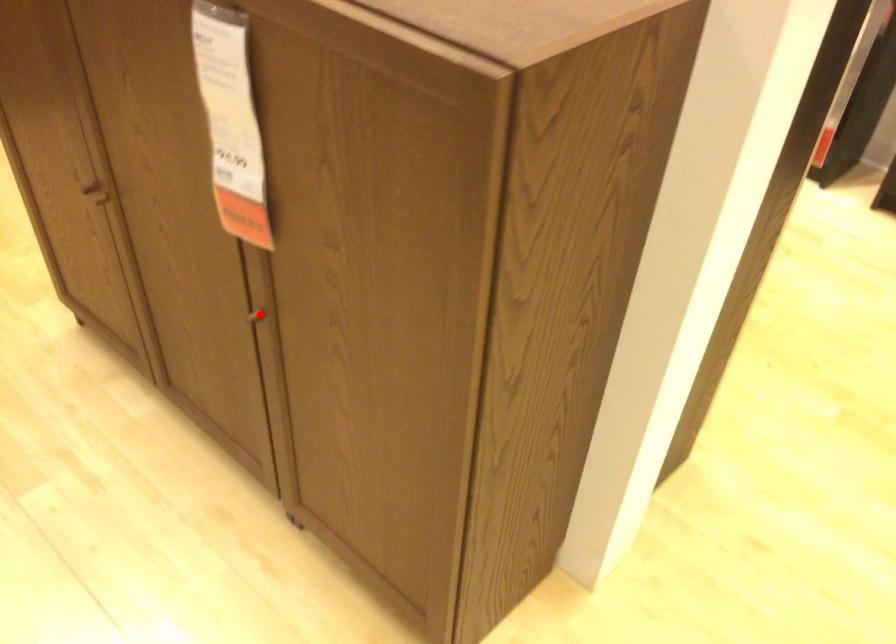
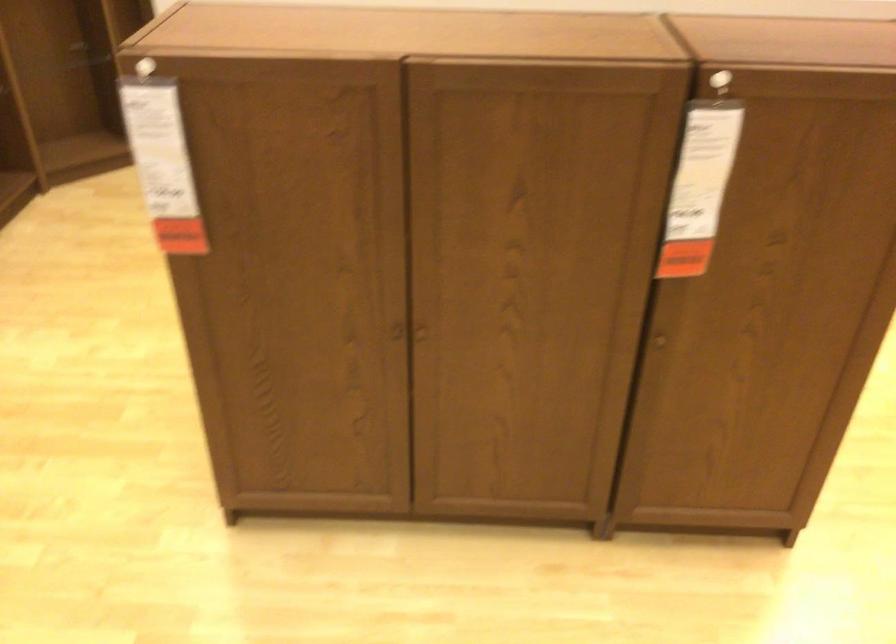
Locate, in the second image, the point that corresponds to the highlighted location in the first image.

(659, 341)